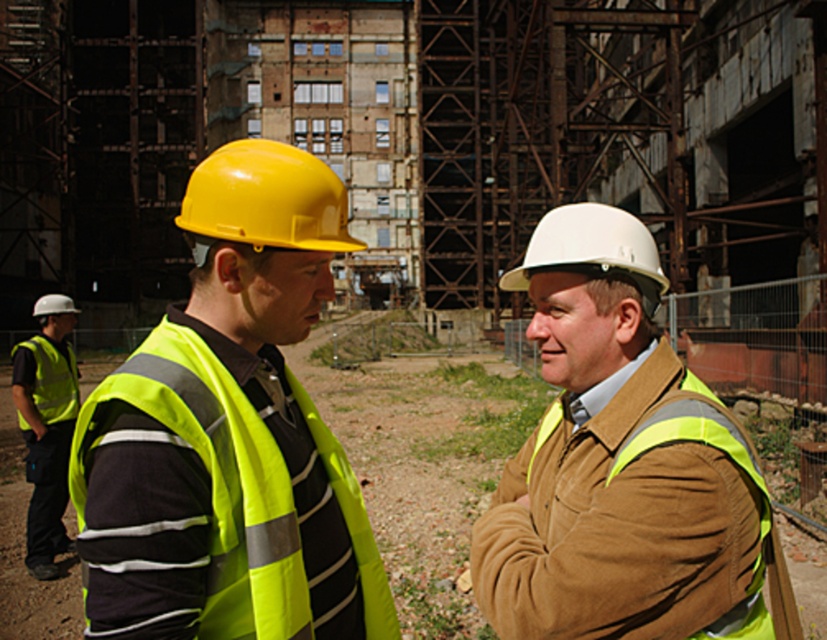
Between matte yellow hard hat at center and high visibility fabric safety vest at left, which one is positioned higher?

matte yellow hard hat at center is above.

Does matte yellow hard hat at center have a smaller size compared to high visibility fabric safety vest at left?

No.

Where is `matte yellow hard hat at center`? matte yellow hard hat at center is located at coordinates (620, 465).

Locate an element on the screen. Image resolution: width=827 pixels, height=640 pixels. matte yellow hard hat at center is located at coordinates (620, 465).

Is white matte hard hat at center closer to the viewer compared to matte yellow helmet at left?

Yes, it is.

Between white matte hard hat at center and matte yellow helmet at left, which one is positioned higher?

Positioned higher is matte yellow helmet at left.

Between point (651, 301) and point (63, 301), which one is positioned behind?

The point (63, 301) is behind.

At what (x,y) coordinates should I click in order to perform the action: click on white matte hard hat at center. Please return your answer as a coordinate pair (x, y). The image size is (827, 640). Looking at the image, I should click on (593, 250).

Can you confirm if yellow hard hat at center is positioned below high visibility fabric safety vest at left?

No, yellow hard hat at center is not below high visibility fabric safety vest at left.

Which is more to the left, yellow hard hat at center or high visibility fabric safety vest at left?

Positioned to the left is high visibility fabric safety vest at left.

Is point (197, 252) positioned in front of point (13, 348)?

Yes, it is.

This screenshot has height=640, width=827. Find the location of `yellow hard hat at center`. yellow hard hat at center is located at coordinates (265, 200).